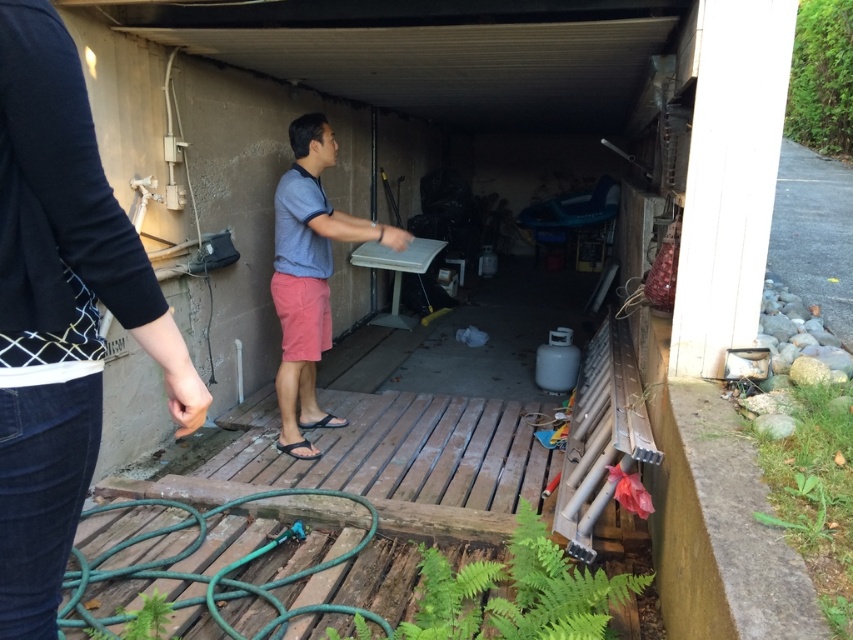
Question: Is black cotton shirt at upper left bigger than gray cotton shirt at center?

Choices:
 (A) no
 (B) yes

Answer: (A)

Question: Which point is farther from the camera taking this photo?

Choices:
 (A) (62, 269)
 (B) (326, 166)

Answer: (B)

Question: Which of the following is the farthest from the observer?

Choices:
 (A) (302, 406)
 (B) (73, 342)

Answer: (A)

Question: Can you confirm if black cotton shirt at upper left is positioned above gray cotton shirt at center?

Choices:
 (A) no
 (B) yes

Answer: (A)

Question: From the image, what is the correct spatial relationship of black cotton shirt at upper left in relation to gray cotton shirt at center?

Choices:
 (A) below
 (B) above

Answer: (A)